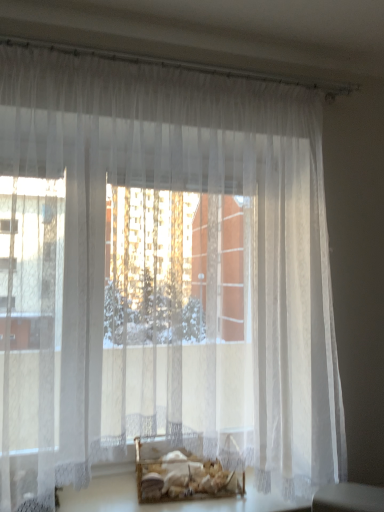
Question: Should I look upward or downward to see wooden crate at center?

Choices:
 (A) up
 (B) down

Answer: (B)

Question: Does translucent glass table at lower center have a larger size compared to wooden crate at center?

Choices:
 (A) yes
 (B) no

Answer: (A)

Question: Can you confirm if translucent glass table at lower center is positioned to the right of wooden crate at center?

Choices:
 (A) no
 (B) yes

Answer: (B)

Question: Is translucent glass table at lower center oriented towards wooden crate at center?

Choices:
 (A) no
 (B) yes

Answer: (A)

Question: Is the depth of translucent glass table at lower center less than that of wooden crate at center?

Choices:
 (A) yes
 (B) no

Answer: (A)

Question: Is translucent glass table at lower center shorter than wooden crate at center?

Choices:
 (A) no
 (B) yes

Answer: (B)

Question: Considering the relative sizes of translucent glass table at lower center and wooden crate at center in the image provided, is translucent glass table at lower center wider than wooden crate at center?

Choices:
 (A) no
 (B) yes

Answer: (B)

Question: Are wooden crate at center and translucent glass table at lower center far apart?

Choices:
 (A) yes
 (B) no

Answer: (B)

Question: Can you confirm if wooden crate at center is wider than translucent glass table at lower center?

Choices:
 (A) no
 (B) yes

Answer: (A)

Question: Is translucent glass table at lower center inside wooden crate at center?

Choices:
 (A) no
 (B) yes

Answer: (A)

Question: Considering the relative sizes of wooden crate at center and translucent glass table at lower center in the image provided, is wooden crate at center thinner than translucent glass table at lower center?

Choices:
 (A) yes
 (B) no

Answer: (A)

Question: From a real-world perspective, is wooden crate at center located beneath translucent glass table at lower center?

Choices:
 (A) yes
 (B) no

Answer: (B)

Question: Is wooden crate at center positioned behind translucent glass table at lower center?

Choices:
 (A) no
 (B) yes

Answer: (B)

Question: Is translucent glass table at lower center in front of or behind wooden crate at center in the image?

Choices:
 (A) behind
 (B) front

Answer: (B)